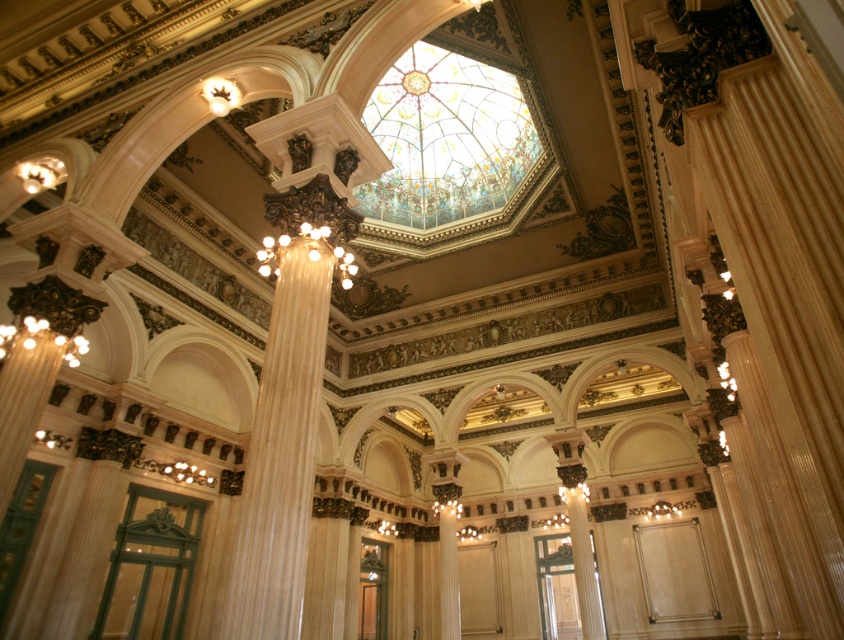
Question: Estimate the real-world distances between objects in this image. Which object is closer to the stained glass dome at center?

Choices:
 (A) white marble pillar at center
 (B) matte gold chandelier at center
 (C) white glossy column at center

Answer: (B)

Question: From the image, what is the correct spatial relationship of white glossy column at center in relation to matte gold chandelier at center?

Choices:
 (A) right
 (B) left

Answer: (B)

Question: Among these points, which one is nearest to the camera?

Choices:
 (A) click(301, 236)
 (B) click(212, 618)

Answer: (A)

Question: Does stained glass dome at center appear on the left side of white glossy column at center?

Choices:
 (A) no
 (B) yes

Answer: (A)

Question: Is white glossy column at center below matte gold chandelier at center?

Choices:
 (A) yes
 (B) no

Answer: (A)

Question: Which object is the farthest from the stained glass dome at center?

Choices:
 (A) matte gold chandelier at center
 (B) white glossy column at center
 (C) white marble pillar at center

Answer: (C)